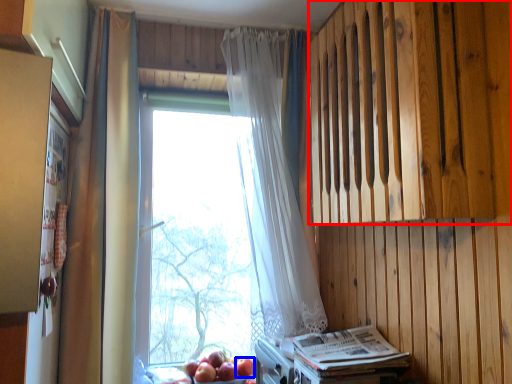
Question: Which of the following is the closest to the observer, wood (highlighted by a red box) or apple (highlighted by a blue box)?

Choices:
 (A) wood
 (B) apple

Answer: (A)